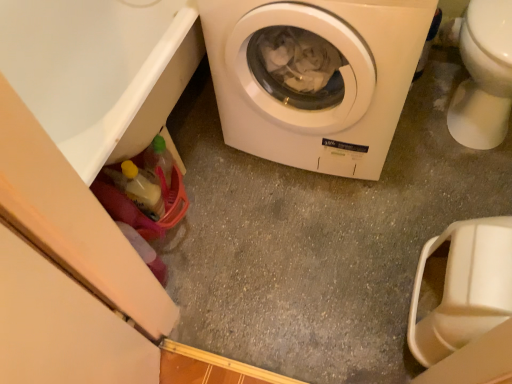
Question: From a real-world perspective, is white glossy toilet bowl at right physically located above or below white matte washing machine at center?

Choices:
 (A) below
 (B) above

Answer: (A)

Question: Considering the positions of white glossy toilet bowl at right and white matte washing machine at center in the image, is white glossy toilet bowl at right wider or thinner than white matte washing machine at center?

Choices:
 (A) thin
 (B) wide

Answer: (B)

Question: Looking at the image, does white glossy toilet bowl at right seem bigger or smaller compared to white matte washing machine at center?

Choices:
 (A) small
 (B) big

Answer: (A)

Question: From a real-world perspective, is white matte washing machine at center above or below white glossy toilet bowl at right?

Choices:
 (A) above
 (B) below

Answer: (A)

Question: Is white matte washing machine at center in front of or behind white glossy toilet bowl at right in the image?

Choices:
 (A) front
 (B) behind

Answer: (A)

Question: In terms of height, does white matte washing machine at center look taller or shorter compared to white glossy toilet bowl at right?

Choices:
 (A) tall
 (B) short

Answer: (A)

Question: Choose the correct answer: Is white matte washing machine at center inside white glossy toilet bowl at right or outside it?

Choices:
 (A) outside
 (B) inside

Answer: (A)